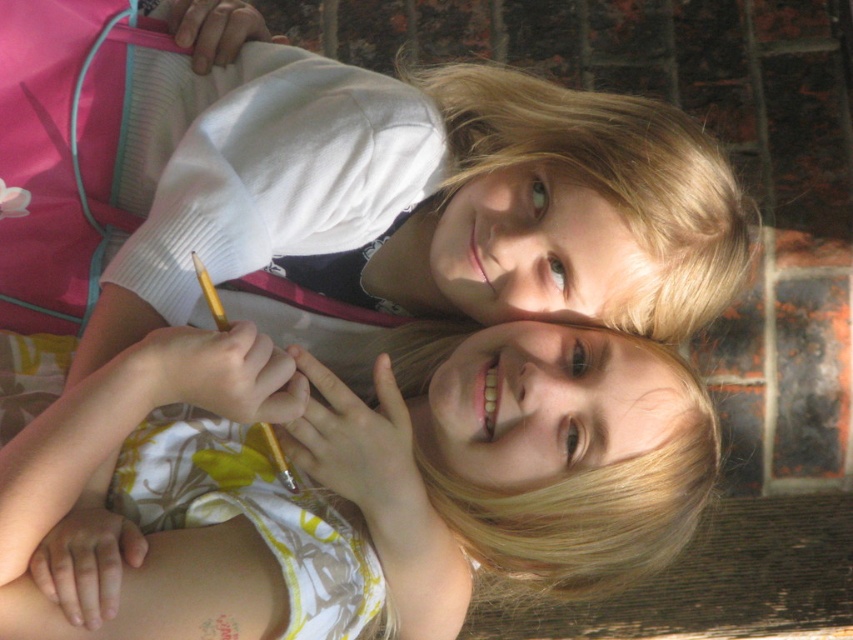
Which is more to the right, white floral dress at center or matte white shirt at upper center?

matte white shirt at upper center

Is white floral dress at center in front of matte white shirt at upper center?

Yes, it is.

You are a GUI agent. You are given a task and a screenshot of the screen. Output one action in this format:
    pyautogui.click(x=<x>, y=<y>)
    Task: Click on the white floral dress at center
    This screenshot has height=640, width=853.
    Given the screenshot: What is the action you would take?
    pyautogui.click(x=354, y=481)